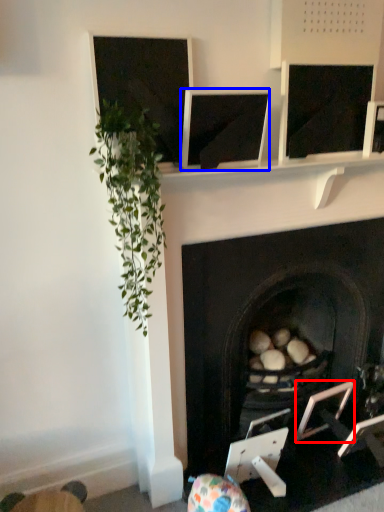
Question: Which of the following is the farthest to the observer, picture frame (highlighted by a red box) or computer screen (highlighted by a blue box)?

Choices:
 (A) picture frame
 (B) computer screen

Answer: (A)